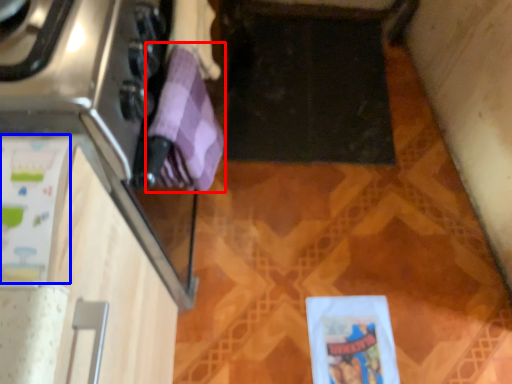
Question: Among these objects, which one is farthest to the camera, wrapping paper (highlighted by a red box) or wrapping paper (highlighted by a blue box)?

Choices:
 (A) wrapping paper
 (B) wrapping paper

Answer: (A)